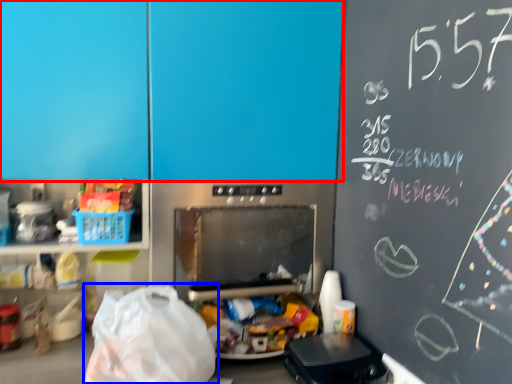
Question: Which point is closer to the camera, leftover (highlighted by a red box) or grocery bag (highlighted by a blue box)?

Choices:
 (A) leftover
 (B) grocery bag

Answer: (B)